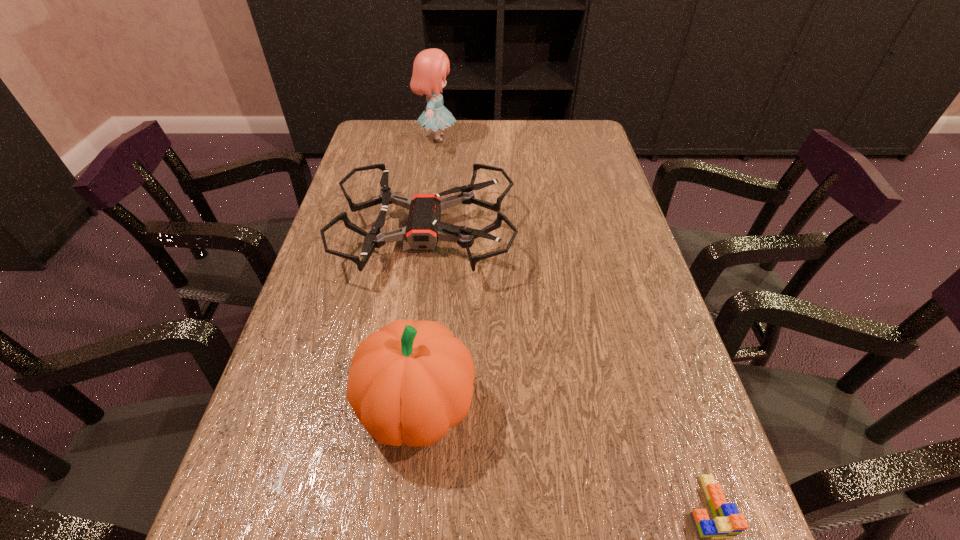
This screenshot has height=540, width=960. In order to click on free region that satisfies the following two spatial constraints: 1. on the front-facing side of the rightmost object; 2. on the left side of the doll in this screenshot , I will do click(387, 507).

This screenshot has width=960, height=540. I want to click on vacant space that satisfies the following two spatial constraints: 1. on the front-facing side of the farthest object; 2. on the back side of the third farthest object, so click(400, 406).

Locate an element on the screen. vacant region that satisfies the following two spatial constraints: 1. with the camera facing forward on the third tallest object; 2. on the right side of the nearest object is located at coordinates (391, 507).

Identify the location of free spot that satisfies the following two spatial constraints: 1. with the camera facing forward on the second shortest object; 2. on the left side of the third shortest object. The image size is (960, 540). (404, 406).